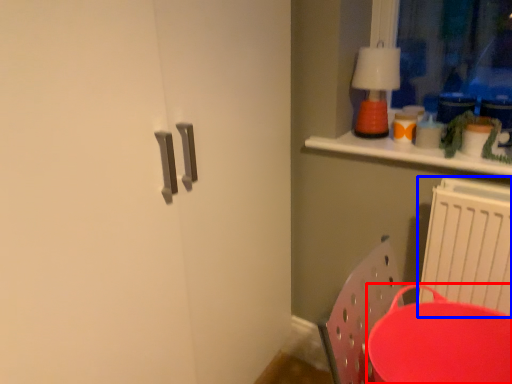
Question: Which point is closer to the camera, round table (highlighted by a red box) or radiator (highlighted by a blue box)?

Choices:
 (A) round table
 (B) radiator

Answer: (A)